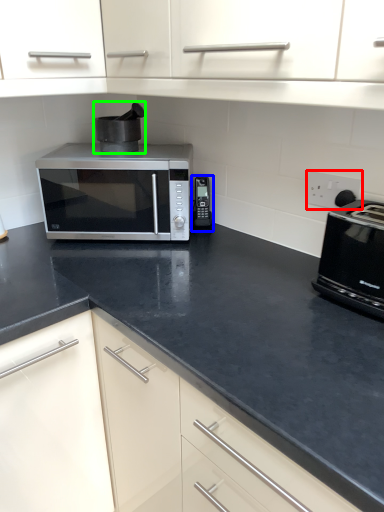
Question: Based on their relative distances, which object is nearer to electric outlet (highlighted by a red box)? Choose from appliance (highlighted by a blue box) and appliance (highlighted by a green box).

Choices:
 (A) appliance
 (B) appliance

Answer: (A)